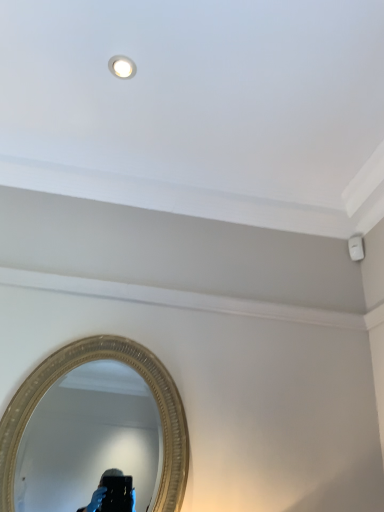
The width and height of the screenshot is (384, 512). I want to click on gold textured mirror at lower left, so click(89, 438).

What do you see at coordinates (89, 438) in the screenshot? I see `gold textured mirror at lower left` at bounding box center [89, 438].

Where is `gold textured mirror at lower left`? The height and width of the screenshot is (512, 384). gold textured mirror at lower left is located at coordinates (89, 438).